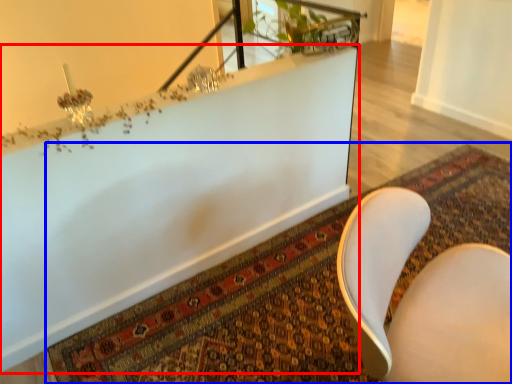
Question: Among these objects, which one is nearest to the camera, bathtub (highlighted by a red box) or mat (highlighted by a blue box)?

Choices:
 (A) bathtub
 (B) mat

Answer: (A)